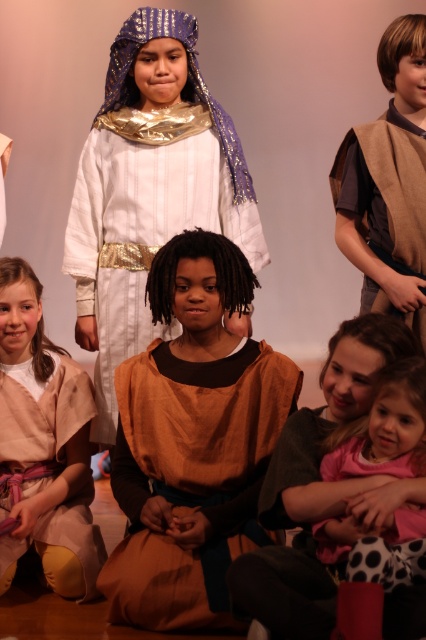
Question: Which point is closer to the camera?

Choices:
 (A) (108, 300)
 (B) (134, 49)
 (C) (383, 454)
 (D) (414, 612)

Answer: (D)

Question: Is brown suede vest at upper right wider than beige fabric robe at center?

Choices:
 (A) no
 (B) yes

Answer: (A)

Question: Considering the real-world distances, which object is closest to the beige fabric robe at center?

Choices:
 (A) pink polka dot dress at lower right
 (B) white satin robe at center
 (C) brown cotton dress at center

Answer: (C)

Question: Is brown suede vest at upper right behind pink polka dot dress at lower right?

Choices:
 (A) yes
 (B) no

Answer: (A)

Question: Does white satin robe at center appear over shiny gold fabric headdress at upper center?

Choices:
 (A) yes
 (B) no

Answer: (B)

Question: Which of the following is the closest to the observer?

Choices:
 (A) (103, 179)
 (B) (88, 401)
 (C) (121, 97)
 (D) (160, 292)

Answer: (D)